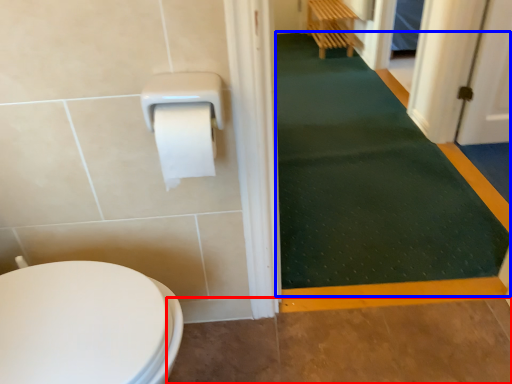
Question: Which of the following is the closest to the observer, path (highlighted by a red box) or bath mat (highlighted by a blue box)?

Choices:
 (A) path
 (B) bath mat

Answer: (A)